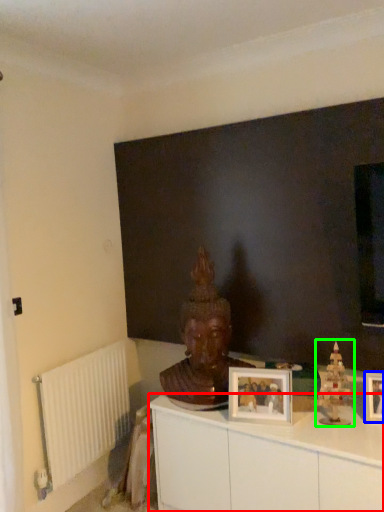
Question: Which object is positioned farthest from cabinetry (highlighted by a red box)? Select from picture frame (highlighted by a blue box) and toy (highlighted by a green box).

Choices:
 (A) picture frame
 (B) toy

Answer: (A)